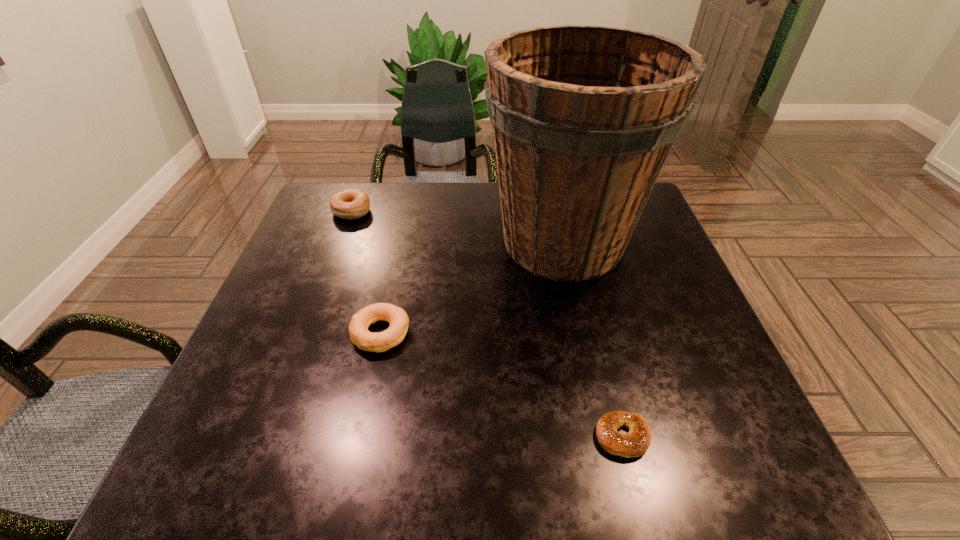
In the image, there is a desktop. Where is `vacant space at the left edge`? Image resolution: width=960 pixels, height=540 pixels. vacant space at the left edge is located at coordinates (270, 413).

You are a GUI agent. You are given a task and a screenshot of the screen. Output one action in this format:
    pyautogui.click(x=<x>, y=<y>)
    Task: Click on the free space at the right edge of the desktop
    The image size is (960, 540).
    Given the screenshot: What is the action you would take?
    pyautogui.click(x=685, y=293)

Where is `blank area at the near left corner`? This screenshot has width=960, height=540. blank area at the near left corner is located at coordinates (210, 455).

At what (x,y) coordinates should I click in order to perform the action: click on vacant area at the far right corner. Please return your answer as a coordinate pair (x, y). This screenshot has height=540, width=960. Looking at the image, I should click on (647, 205).

The height and width of the screenshot is (540, 960). What are the coordinates of `free space at the near right corner` in the screenshot? It's located at (709, 440).

The image size is (960, 540). I want to click on empty space between the second object from left to right and the bucket, so click(471, 287).

You are a GUI agent. You are given a task and a screenshot of the screen. Output one action in this format:
    pyautogui.click(x=<x>, y=<y>)
    Task: Click on the empty space that is in between the shortest object and the second tallest object
    Image resolution: width=960 pixels, height=540 pixels.
    Given the screenshot: What is the action you would take?
    pyautogui.click(x=487, y=325)

Find the location of `empty space that is in between the rightmost bagel and the second nearest object`. empty space that is in between the rightmost bagel and the second nearest object is located at coordinates [501, 385].

The height and width of the screenshot is (540, 960). What are the coordinates of `free area in between the tallest object and the nearest object` in the screenshot? It's located at (592, 339).

Where is `vacant area that lies between the nearest bagel and the bucket`? The height and width of the screenshot is (540, 960). vacant area that lies between the nearest bagel and the bucket is located at coordinates (592, 339).